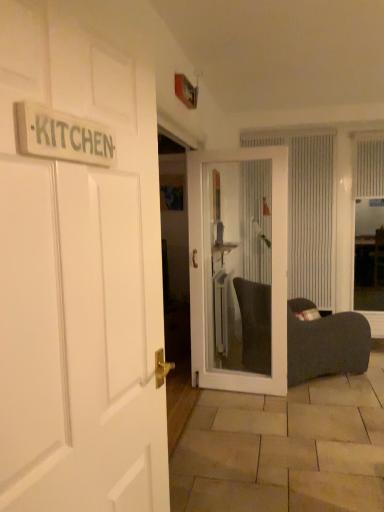
Question: From a real-world perspective, does white wooden door at left, the second door from the back, stand above white textured window screen at right?

Choices:
 (A) no
 (B) yes

Answer: (B)

Question: Is white wooden door at left, arranged as the first door when viewed from the front, thinner than white textured window screen at right?

Choices:
 (A) no
 (B) yes

Answer: (B)

Question: Is white textured window screen at right surrounded by white wooden door at left, which is counted as the first door, starting from the left?

Choices:
 (A) yes
 (B) no

Answer: (B)

Question: Is white wooden door at left, arranged as the first door when viewed from the front, behind white textured window screen at right?

Choices:
 (A) no
 (B) yes

Answer: (A)

Question: Considering the relative sizes of white wooden door at left, the second door from the back, and white textured window screen at right in the image provided, is white wooden door at left, the second door from the back, taller than white textured window screen at right?

Choices:
 (A) yes
 (B) no

Answer: (B)

Question: Can you confirm if white wooden door at left, the 2th door when ordered from right to left, is wider than white textured window screen at right?

Choices:
 (A) yes
 (B) no

Answer: (B)

Question: Is white glass door at center, arranged as the 1th door when viewed from the right, facing towards wooden sign at upper left?

Choices:
 (A) yes
 (B) no

Answer: (A)

Question: Does white glass door at center, which ranks as the 2th door in front-to-back order, appear on the left side of wooden sign at upper left?

Choices:
 (A) yes
 (B) no

Answer: (B)

Question: Considering the relative sizes of white glass door at center, the 1th door positioned from the back, and wooden sign at upper left in the image provided, is white glass door at center, the 1th door positioned from the back, thinner than wooden sign at upper left?

Choices:
 (A) no
 (B) yes

Answer: (A)

Question: From the image's perspective, is white glass door at center, the 1th door positioned from the back, under wooden sign at upper left?

Choices:
 (A) no
 (B) yes

Answer: (B)

Question: Is white glass door at center, the second door in the left-to-right sequence, closer to camera compared to wooden sign at upper left?

Choices:
 (A) yes
 (B) no

Answer: (B)

Question: From a real-world perspective, is white glass door at center, which ranks as the 2th door in front-to-back order, positioned under wooden sign at upper left based on gravity?

Choices:
 (A) no
 (B) yes

Answer: (B)

Question: Is white glass door at center, the 1th door positioned from the back, far from white textured window screen at right?

Choices:
 (A) no
 (B) yes

Answer: (B)